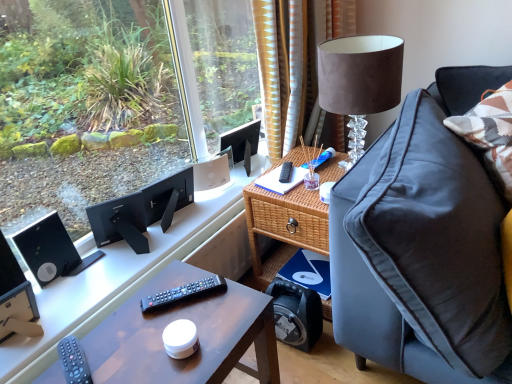
Find the location of a particular element. The image size is (512, 384). vacant space to the right of black plastic speaker at upper left, which ranks as the second loudspeaker in front-to-back order is located at coordinates (100, 277).